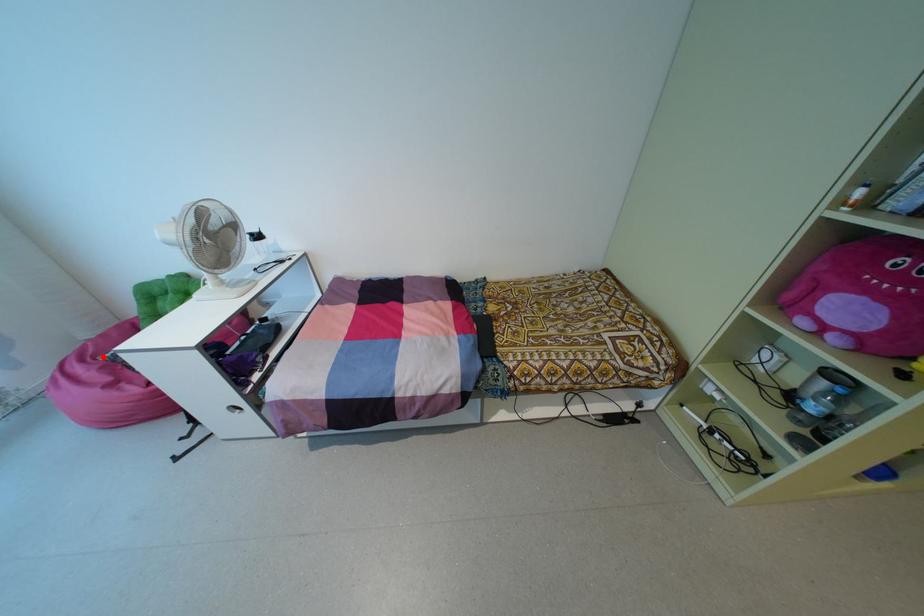
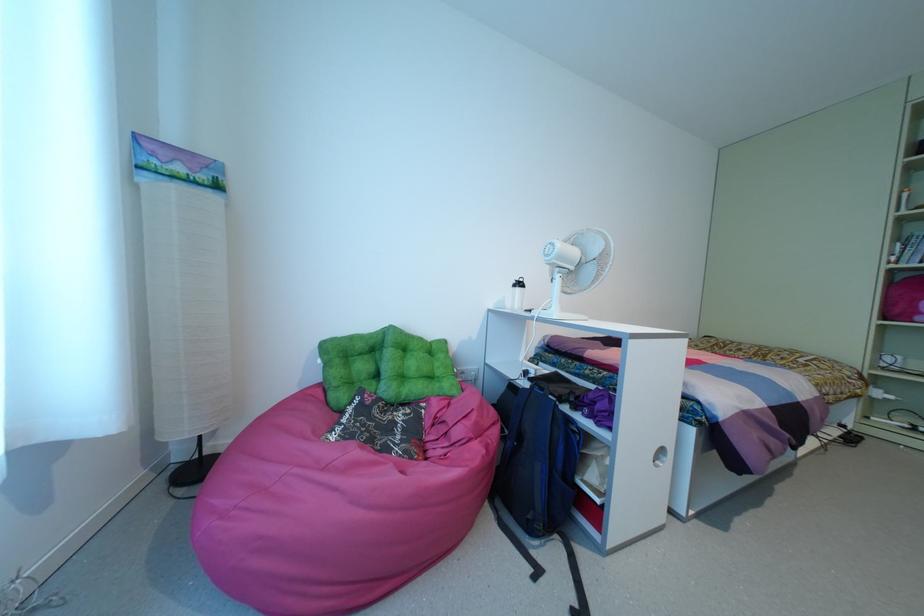
Locate, in the second image, the point that corresponds to the highlighted location in the first image.

(332, 437)